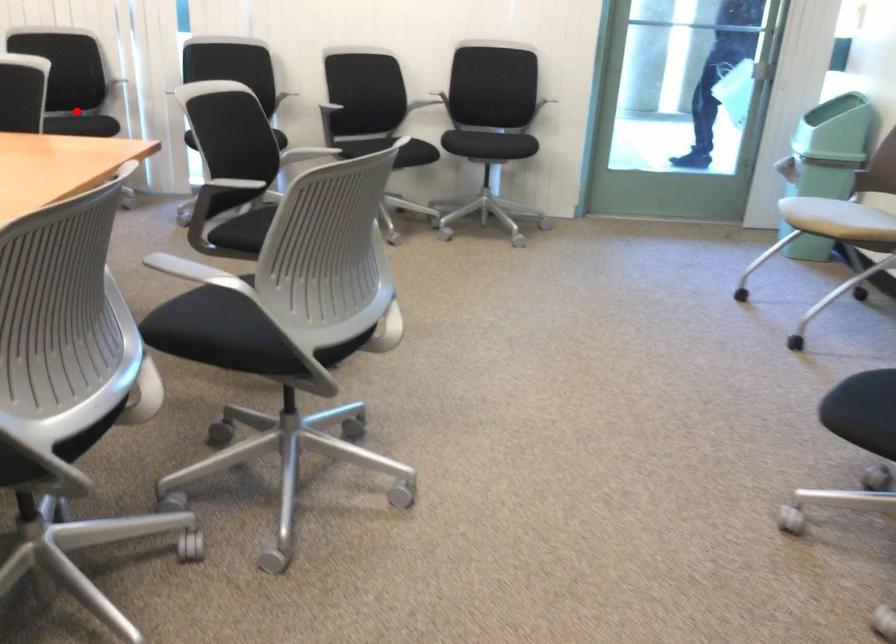
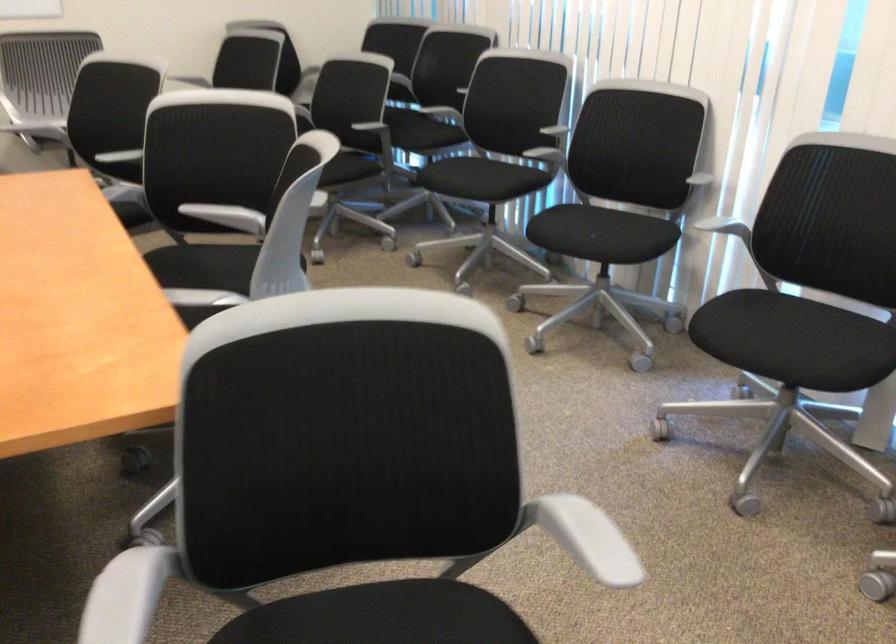
Question: I am providing you with two images of the same scene from different viewpoints. Given a red point in image1, look at the same physical point in image2. Is it:

Choices:
 (A) Closer to the viewpoint
 (B) Farther from the viewpoint

Answer: (A)